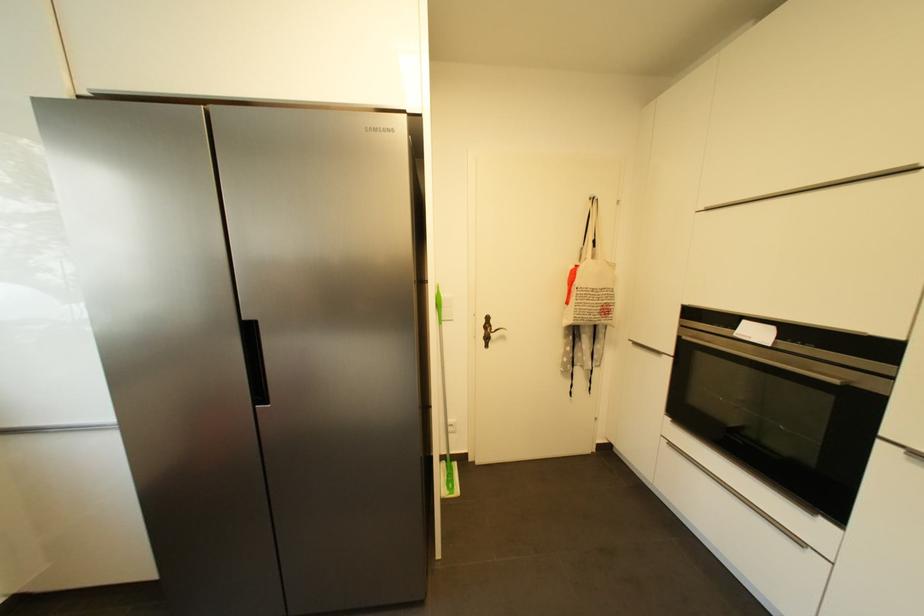
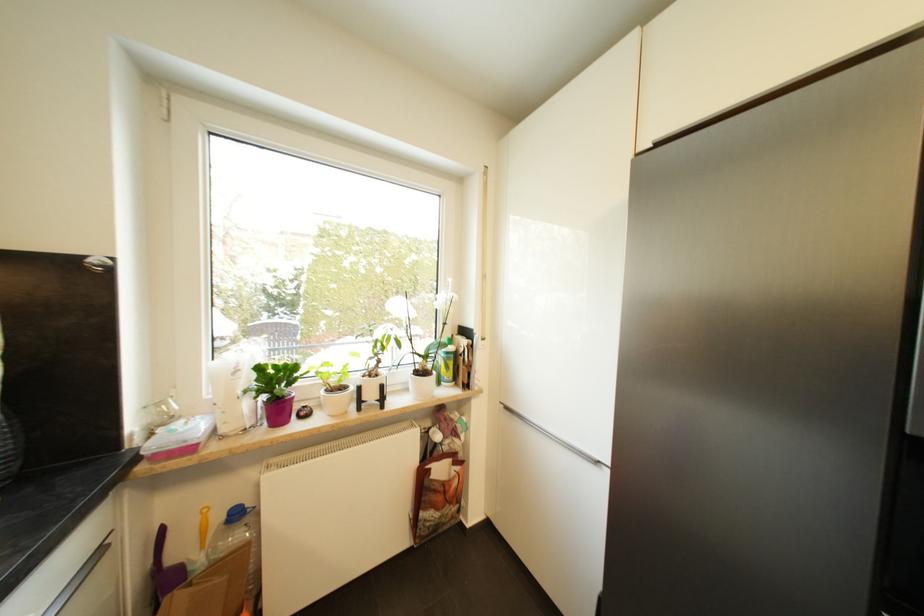
Question: The first image is from the beginning of the video and the second image is from the end. How did the camera likely rotate when shooting the video?

Choices:
 (A) Left
 (B) Right
 (C) Up
 (D) Down

Answer: (A)